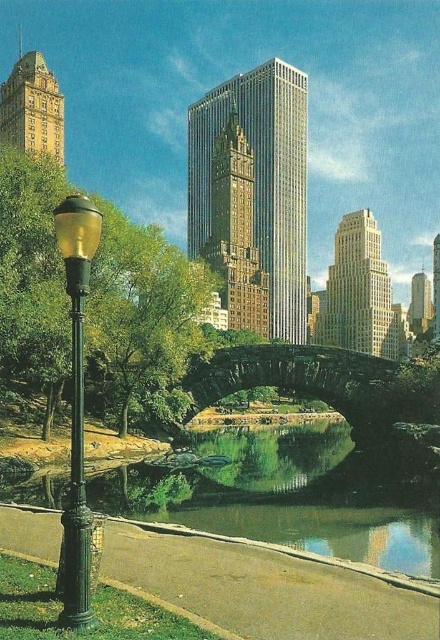
You are standing at the point labeled as point (286, 496) in the image. What do you see around you?

You are standing in the green reflective water at center, as indicated by the point (286, 496).

You are a tourist standing on the stone bridge in the park. You see the green reflective water at center and the shiny silver skyscraper at right. Which object is closer to your right side?

The shiny silver skyscraper at right is closer to your right side because it is positioned to the right of the green reflective water at center.